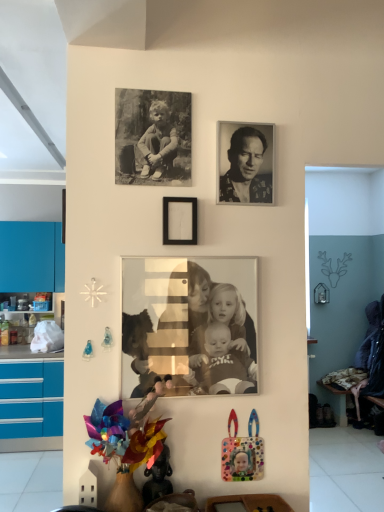
Question: Can you confirm if sepia-toned photograph of family at center, the 2th person in the top-to-bottom sequence, is positioned to the left of black matte picture frame at center, marked as the 1th picture frame in a bottom-to-top arrangement?

Choices:
 (A) yes
 (B) no

Answer: (B)

Question: Is sepia-toned photograph of family at center, the 2th person in the top-to-bottom sequence, turned away from black matte picture frame at center, which is counted as the second picture frame, starting from the top?

Choices:
 (A) yes
 (B) no

Answer: (B)

Question: From a real-world perspective, is sepia-toned photograph of family at center, marked as the first person in a bottom-to-top arrangement, physically above black matte picture frame at center, marked as the 1th picture frame in a bottom-to-top arrangement?

Choices:
 (A) yes
 (B) no

Answer: (B)

Question: Considering the relative positions of sepia-toned photograph of family at center, the 2th person in the top-to-bottom sequence, and black matte picture frame at center, marked as the 1th picture frame in a bottom-to-top arrangement, in the image provided, is sepia-toned photograph of family at center, the 2th person in the top-to-bottom sequence, to the right of black matte picture frame at center, marked as the 1th picture frame in a bottom-to-top arrangement, from the viewer's perspective?

Choices:
 (A) no
 (B) yes

Answer: (B)

Question: Can you confirm if sepia-toned photograph of family at center, the 2th person in the top-to-bottom sequence, is smaller than black matte picture frame at center, marked as the 1th picture frame in a bottom-to-top arrangement?

Choices:
 (A) no
 (B) yes

Answer: (A)

Question: From a real-world perspective, is black and white photograph of a man at upper center, which appears as the first person when viewed from the top, physically located above or below sepia-toned photograph of family at center, marked as the first person in a bottom-to-top arrangement?

Choices:
 (A) below
 (B) above

Answer: (B)

Question: In terms of size, does black and white photograph of a man at upper center, which appears as the first person when viewed from the top, appear bigger or smaller than sepia-toned photograph of family at center, marked as the first person in a bottom-to-top arrangement?

Choices:
 (A) small
 (B) big

Answer: (A)

Question: In terms of height, does black and white photograph of a man at upper center, which appears as the first person when viewed from the top, look taller or shorter compared to sepia-toned photograph of family at center, marked as the first person in a bottom-to-top arrangement?

Choices:
 (A) tall
 (B) short

Answer: (B)

Question: Is black and white photograph of a man at upper center, which appears as the first person when viewed from the top, in front of or behind sepia-toned photograph of family at center, marked as the first person in a bottom-to-top arrangement, in the image?

Choices:
 (A) front
 (B) behind

Answer: (B)

Question: Is sepia-toned photograph of family at center, the 2th person in the top-to-bottom sequence, taller or shorter than black and white photograph of a man at upper center, which appears as the first person when viewed from the top?

Choices:
 (A) tall
 (B) short

Answer: (A)

Question: In the image, is sepia-toned photograph of family at center, the 2th person in the top-to-bottom sequence, on the left side or the right side of black and white photograph of a man at upper center, which appears as the first person when viewed from the top?

Choices:
 (A) left
 (B) right

Answer: (A)

Question: Considering the positions of sepia-toned photograph of family at center, marked as the first person in a bottom-to-top arrangement, and black and white photograph of a man at upper center, the 2th person ordered from the bottom, in the image, is sepia-toned photograph of family at center, marked as the first person in a bottom-to-top arrangement, wider or thinner than black and white photograph of a man at upper center, the 2th person ordered from the bottom,?

Choices:
 (A) wide
 (B) thin

Answer: (B)

Question: From a real-world perspective, is sepia-toned photograph of family at center, the 2th person in the top-to-bottom sequence, physically located above or below black and white photograph of a man at upper center, which appears as the first person when viewed from the top?

Choices:
 (A) below
 (B) above

Answer: (A)

Question: In the image, is polka dot plastic frame at lower right, which is counted as the second toy, starting from the left, on the left side or the right side of sepia-toned photograph of family at center, the 2th person in the top-to-bottom sequence?

Choices:
 (A) right
 (B) left

Answer: (A)

Question: From their relative heights in the image, would you say polka dot plastic frame at lower right, which ranks as the first toy in right-to-left order, is taller or shorter than sepia-toned photograph of family at center, marked as the first person in a bottom-to-top arrangement?

Choices:
 (A) tall
 (B) short

Answer: (B)